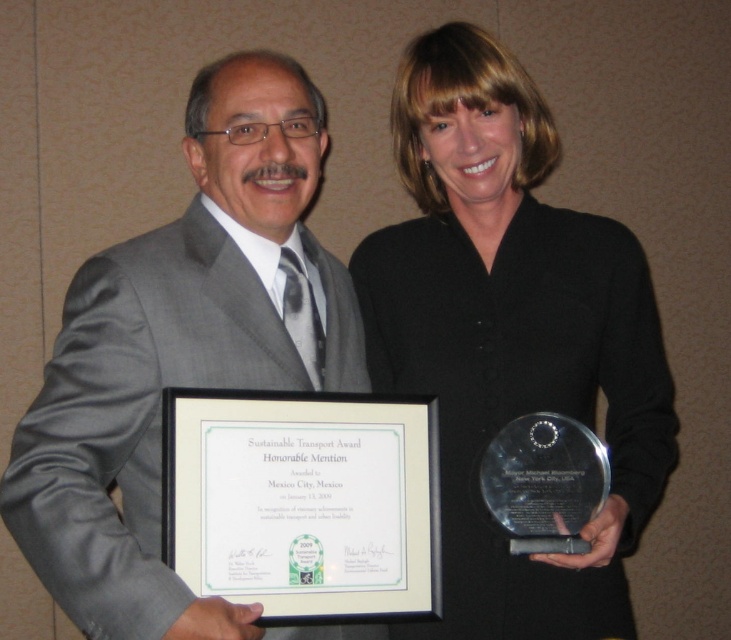
Question: Which object appears farthest from the camera in this image?

Choices:
 (A) black matte award at center
 (B) gray suit at center

Answer: (A)

Question: Among these objects, which one is nearest to the camera?

Choices:
 (A) black matte award at center
 (B) gray suit at center

Answer: (B)

Question: Does black matte award at center appear on the right side of gray suit at center?

Choices:
 (A) no
 (B) yes

Answer: (B)

Question: Is the position of black matte award at center more distant than that of gray suit at center?

Choices:
 (A) no
 (B) yes

Answer: (B)

Question: Does black matte award at center lie behind gray suit at center?

Choices:
 (A) no
 (B) yes

Answer: (B)

Question: Which point appears farthest from the camera in this image?

Choices:
 (A) (102, 579)
 (B) (580, 577)

Answer: (B)